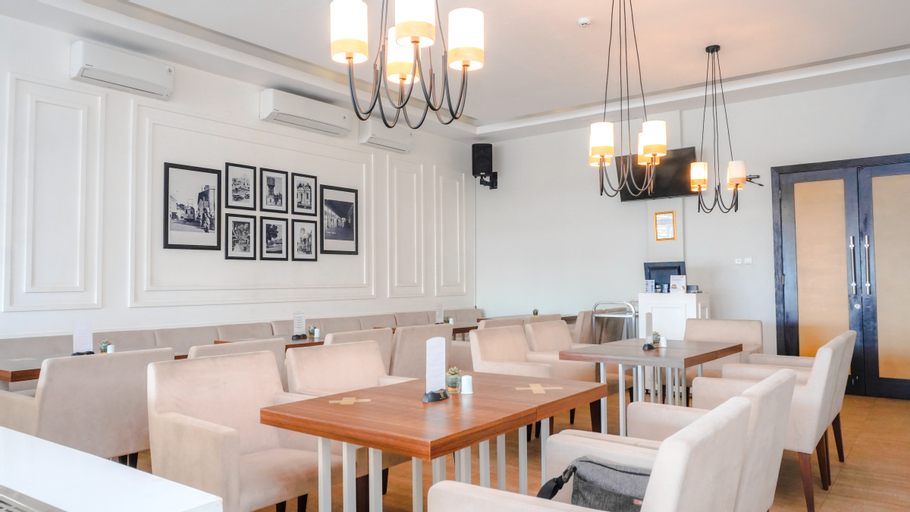
The width and height of the screenshot is (910, 512). Identify the location of cactus decor on tables. (654, 337), (452, 382), (532, 310), (446, 318), (309, 330), (100, 345).